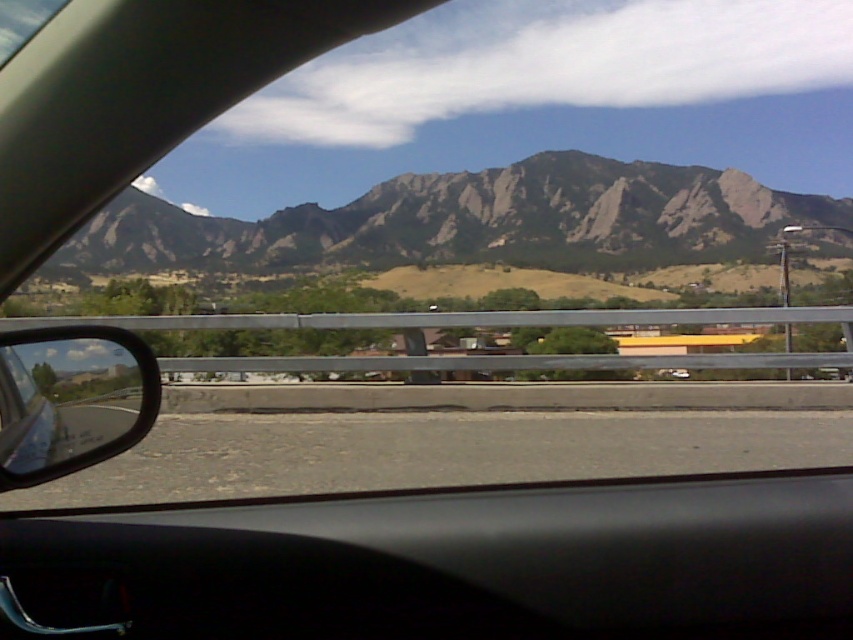
Between black matte dashboard at center and shiny black mirror at left, which one is positioned higher?

Positioned higher is black matte dashboard at center.

The height and width of the screenshot is (640, 853). What do you see at coordinates (474, 561) in the screenshot?
I see `black matte dashboard at center` at bounding box center [474, 561].

Find the location of `black matte dashboard at center`. black matte dashboard at center is located at coordinates (474, 561).